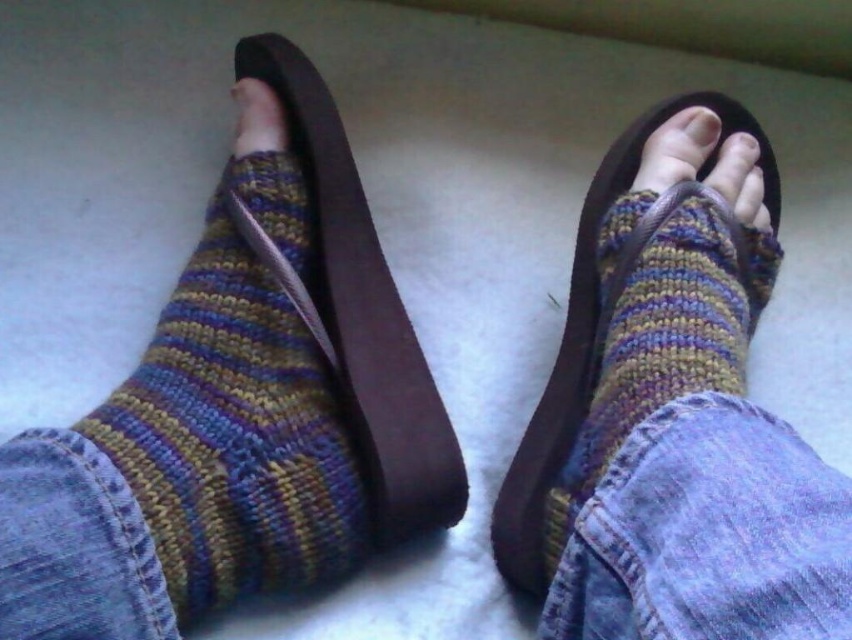
You are standing at the point marked as point (744,189) and want to walk to the other side of the room. There is an obstacle 3.58 feet away from your current position. Can you safely navigate around it without getting too close?

Since the obstacle is 3.58 feet away from point (744,189), you can safely navigate around it by maintaining a distance greater than 3.58 feet to avoid getting too close.

You are a photographer trying to capture the details of the multicolored knitted sock at left and the matte brown leather toe at center. Since you want to focus on the sock first, which object should you adjust your camera lens to focus on first based on their positions?

The multicolored knitted sock at left is closer to the viewer than the matte brown leather toe at center, so you should focus on the multicolored knitted sock at left first.